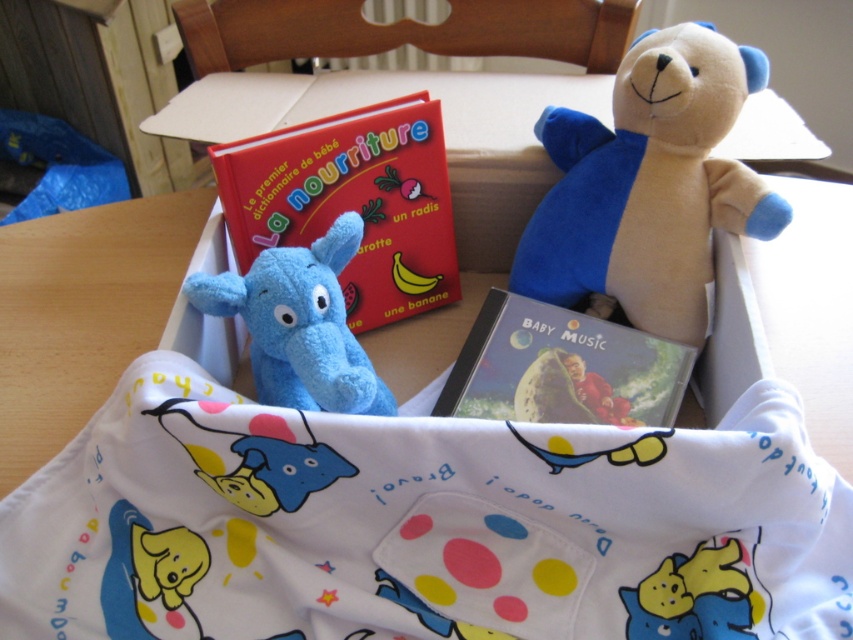
You are looking at a gift box containing two plush toys. The first toy is at point [370,324] and the second is at point [656,371]. Which toy is closer to you?

The toy at point [370,324] is closer to you because it is further to the viewer than the toy at point [656,371].

You are a parent trying to organize the items in the gift box. You need to place a small decorative ribbon between the soft plush bear at upper right and the red matte book at center. Is there enough space to fit the ribbon between them?

The soft plush bear at upper right and the red matte book at center are 15.66 centimeters apart, so there is sufficient space to place a small decorative ribbon between them.

From the picture: You are organizing a gift box for a baby shower. You have a red matte book at center and a matte plastic cd at center inside. Which item takes up more space in the box?

The red matte book at center takes up more space in the box because it has a larger size compared to the matte plastic cd at center.